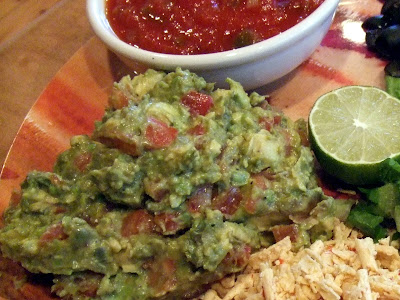
This screenshot has height=300, width=400. What are the coordinates of `wooden table in the background` in the screenshot? It's located at (66, 5), (66, 33), (25, 101), (6, 135), (10, 8), (10, 62), (39, 28), (39, 45).